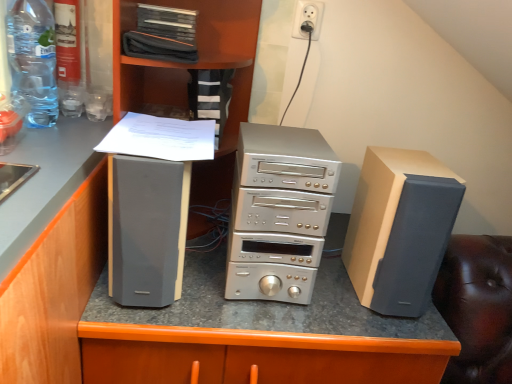
Locate an element on the screen. Image resolution: width=512 pixels, height=384 pixels. free point to the right of transparent plastic bottle at upper left is located at coordinates (76, 133).